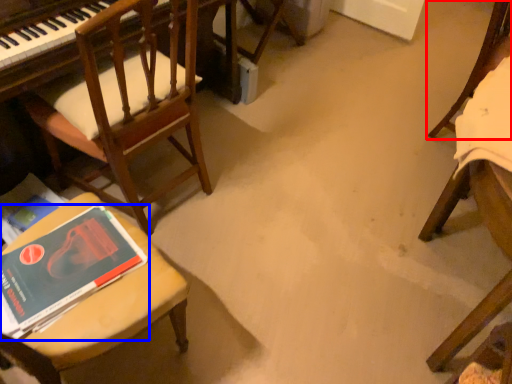
Question: Which point is further to the camera, chair (highlighted by a red box) or book (highlighted by a blue box)?

Choices:
 (A) chair
 (B) book

Answer: (A)